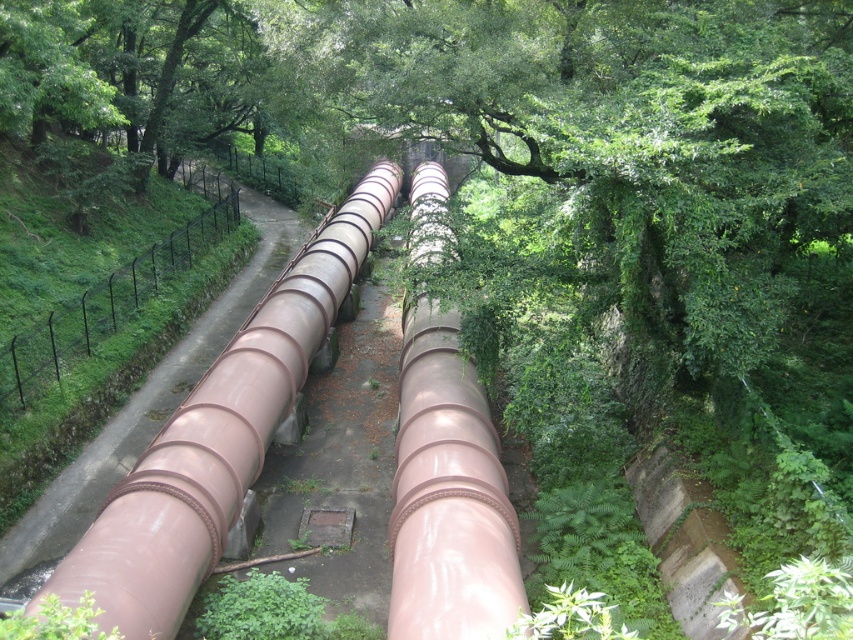
Question: Is the position of glossy metallic pipe at center more distant than that of black metal fence at left?

Choices:
 (A) yes
 (B) no

Answer: (B)

Question: Which point is closer to the camera?

Choices:
 (A) (138, 269)
 (B) (403, 436)
 (C) (212, 488)

Answer: (C)

Question: Can you confirm if glossy metallic water pipe at center is bigger than black metal fence at left?

Choices:
 (A) no
 (B) yes

Answer: (A)

Question: Based on their relative distances, which object is farther from the black metal fence at left?

Choices:
 (A) glossy metallic water pipe at center
 (B) glossy metallic pipe at center

Answer: (A)

Question: Which object is closer to the camera taking this photo?

Choices:
 (A) black metal fence at left
 (B) glossy metallic pipe at center

Answer: (B)

Question: Is glossy metallic pipe at center positioned behind black metal fence at left?

Choices:
 (A) no
 (B) yes

Answer: (A)